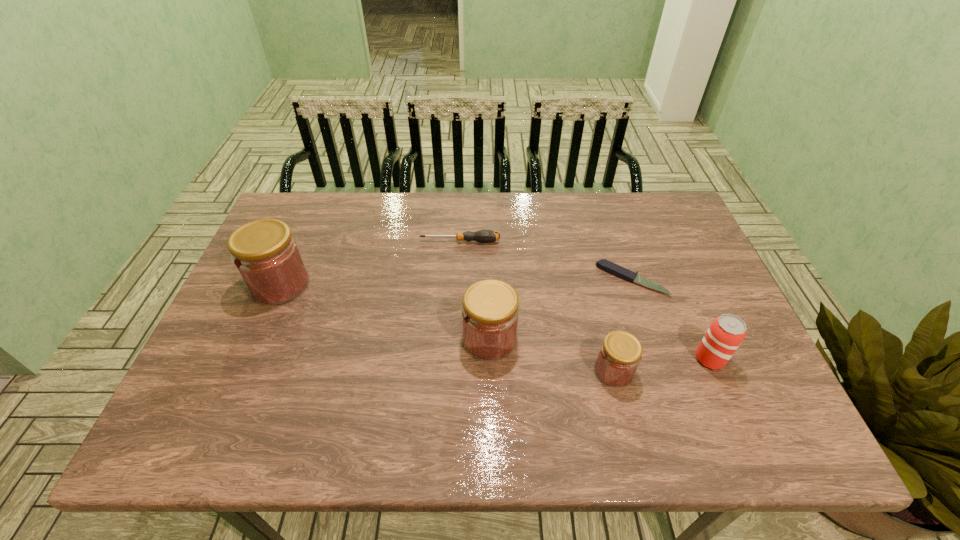
Image resolution: width=960 pixels, height=540 pixels. In order to click on steak knife that is at the right edge in this screenshot , I will do `click(608, 266)`.

Locate an element on the screen. object that is at the near right corner is located at coordinates (725, 334).

The height and width of the screenshot is (540, 960). Identify the location of free space at the far edge. (396, 222).

Locate an element on the screen. This screenshot has width=960, height=540. vacant space at the near edge is located at coordinates (367, 391).

The height and width of the screenshot is (540, 960). In order to click on vacant area at the left edge of the desktop in this screenshot , I will do `click(201, 368)`.

Identify the location of free space at the right edge of the desktop. This screenshot has width=960, height=540. (657, 280).

The width and height of the screenshot is (960, 540). In the image, there is a desktop. In order to click on free space at the far right corner in this screenshot , I will do 672,212.

Locate an element on the screen. The height and width of the screenshot is (540, 960). vacant space in between the second shortest object and the beer can is located at coordinates (585, 300).

Image resolution: width=960 pixels, height=540 pixels. Identify the location of free space between the farthest object and the beer can. (585, 300).

The width and height of the screenshot is (960, 540). Identify the location of free area in between the steak knife and the screwdriver. (546, 260).